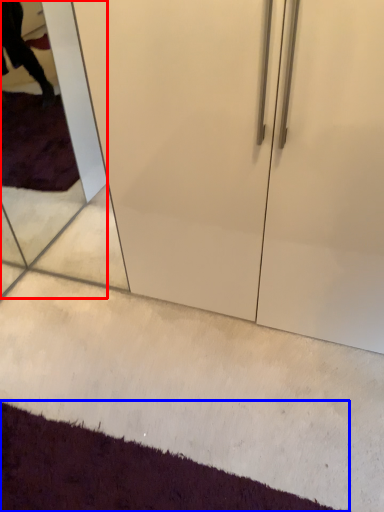
Question: Which point is further to the camera, glass door (highlighted by a red box) or doormat (highlighted by a blue box)?

Choices:
 (A) glass door
 (B) doormat

Answer: (A)